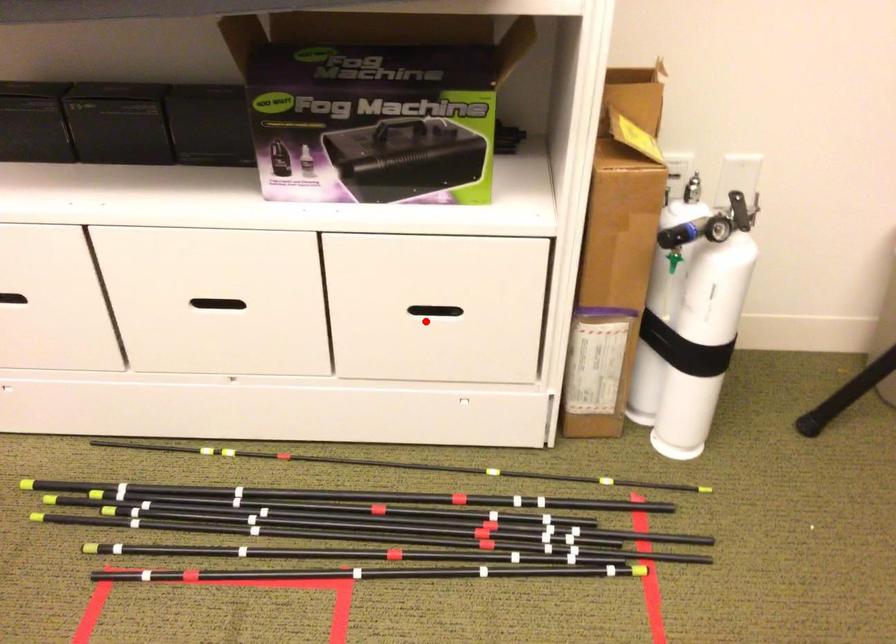
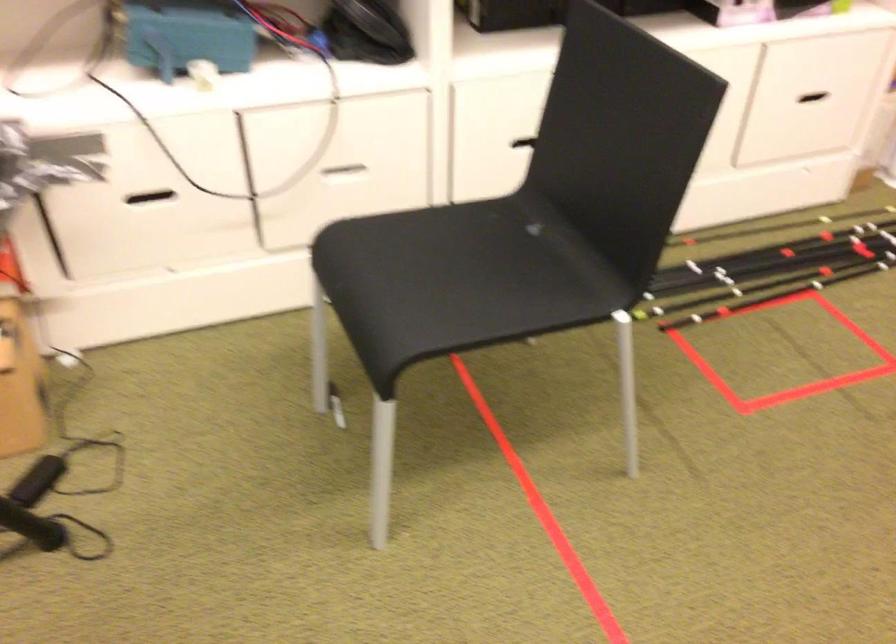
Where in the second image is the point corresponding to the highlighted location from the first image?

(806, 102)